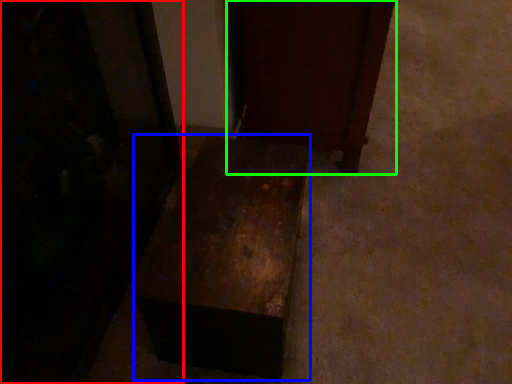
Question: Which object is the farthest from furniture (highlighted by a red box)? Choose among these: furniture (highlighted by a blue box) or furniture (highlighted by a green box).

Choices:
 (A) furniture
 (B) furniture

Answer: (B)